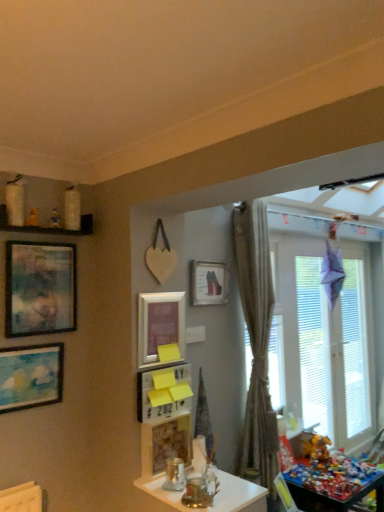
Image resolution: width=384 pixels, height=512 pixels. Identify the location of free space above translucent glass table at center, the first table positioned from the left (from a real-world perspective). (196, 482).